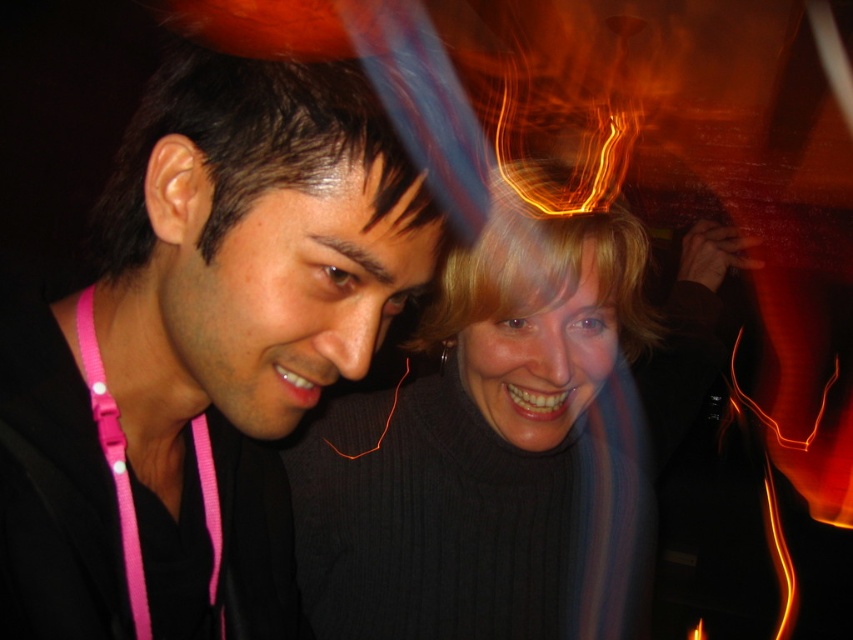
Question: Among these points, which one is farthest from the camera?

Choices:
 (A) (297, 451)
 (B) (135, 529)

Answer: (A)

Question: Does black ribbed sweater at center have a lesser width compared to pink fabric lanyard at left?

Choices:
 (A) yes
 (B) no

Answer: (B)

Question: Can you confirm if black matte jacket at left is thinner than black ribbed sweater at center?

Choices:
 (A) yes
 (B) no

Answer: (A)

Question: Which object appears closest to the camera in this image?

Choices:
 (A) pink fabric lanyard at left
 (B) black ribbed sweater at center
 (C) black matte jacket at left

Answer: (C)

Question: Estimate the real-world distances between objects in this image. Which object is closer to the black matte jacket at left?

Choices:
 (A) black ribbed sweater at center
 (B) pink fabric lanyard at left

Answer: (B)

Question: Is black ribbed sweater at center wider than pink fabric lanyard at left?

Choices:
 (A) no
 (B) yes

Answer: (B)